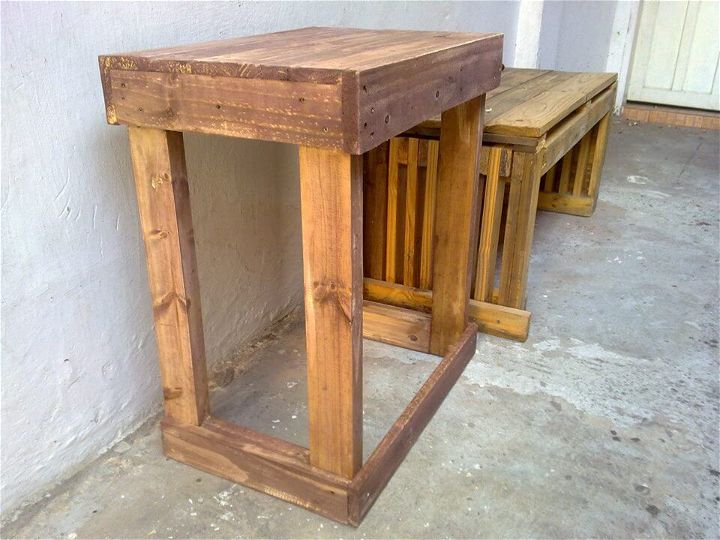
Where is `white wall`? Image resolution: width=720 pixels, height=540 pixels. white wall is located at coordinates (29, 332).